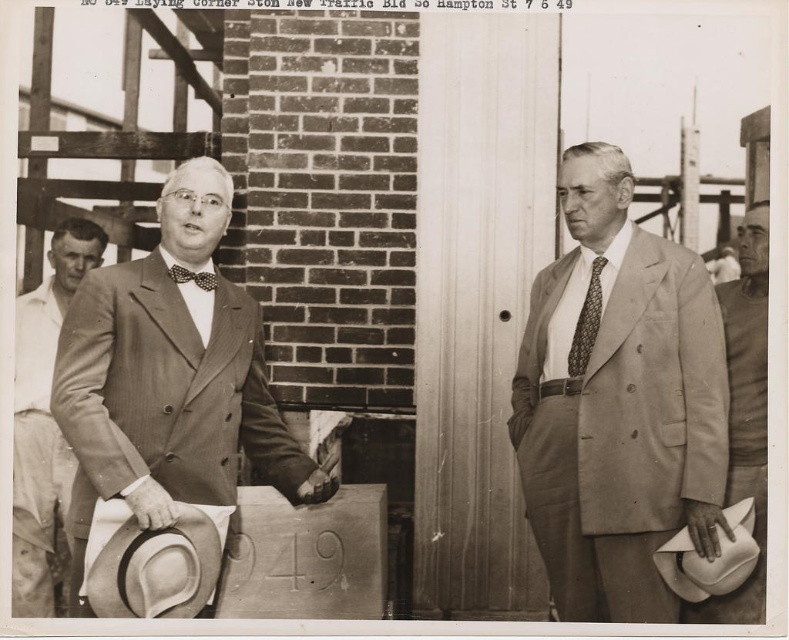
Question: Which is nearer to the light beige felt hat at lower left?

Choices:
 (A) polka dot silk bow tie at left
 (B) patterned silk tie at center

Answer: (A)

Question: Can you confirm if light gray cotton suit at left is wider than smooth skin hand at lower right?

Choices:
 (A) no
 (B) yes

Answer: (B)

Question: Which object is farther from the camera taking this photo?

Choices:
 (A) smooth leather hand at center
 (B) patterned silk tie at center

Answer: (A)

Question: Which point is closer to the camera taking this photo?

Choices:
 (A) pyautogui.click(x=200, y=506)
 (B) pyautogui.click(x=316, y=502)

Answer: (A)

Question: Considering the relative positions of patterned silk tie at center and polka dot silk bow tie at left in the image provided, where is patterned silk tie at center located with respect to polka dot silk bow tie at left?

Choices:
 (A) left
 (B) right

Answer: (B)

Question: Does light gray cotton suit at left come in front of smooth leather hand at center?

Choices:
 (A) no
 (B) yes

Answer: (A)